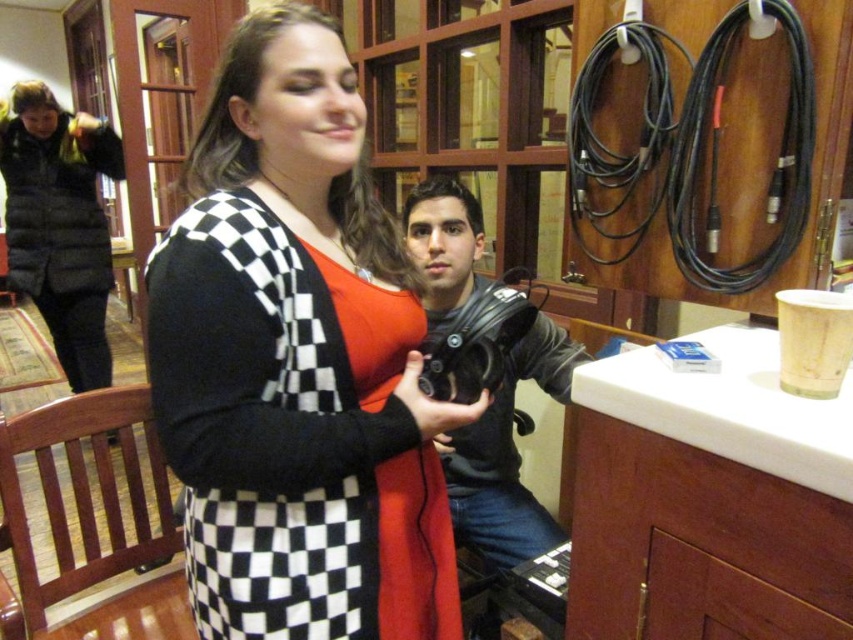
You are setting up a microphone in this room and need to place it on a surface. You have the black checkered sweater at center and the white matte counter top at right. Which surface is suitable for placing the microphone?

The white matte counter top at right is suitable for placing the microphone because it is a stable surface, whereas the black checkered sweater at center is likely part of a person and not a surface.

You are standing in the room and want to place a small vase on the white matte counter top at right. The point given is point (x=730, y=406). Is this point a suitable location to place the vase?

The point (x=730, y=406) is on the white matte counter top at right, so yes, this point is a suitable location to place the vase.

You are setting up a photo shoot in this room and need to position a model near the black checkered sweater at center and the white matte counter top at right. Based on their positions, which object should the model stand closer to if they want to be near the center of the room?

The model should stand closer to the black checkered sweater at center since it is positioned to the left of the white matte counter top at right, placing it nearer to the room center.